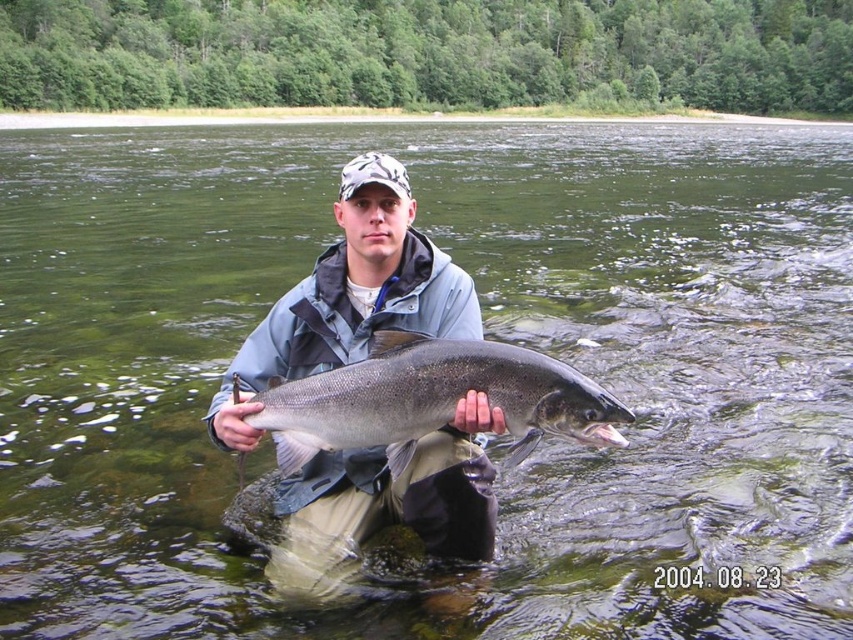
Question: From the image, what is the correct spatial relationship of gray matte fish at center in relation to shiny silver fish at center?

Choices:
 (A) left
 (B) right

Answer: (A)

Question: Is gray matte fish at center above shiny silver fish at center?

Choices:
 (A) yes
 (B) no

Answer: (A)

Question: Which object is closer to the camera taking this photo?

Choices:
 (A) shiny silver fish at center
 (B) gray matte fish at center

Answer: (A)

Question: Among these objects, which one is farthest from the camera?

Choices:
 (A) gray matte fish at center
 (B) shiny silver fish at center

Answer: (A)

Question: Is the position of gray matte fish at center less distant than that of shiny silver fish at center?

Choices:
 (A) yes
 (B) no

Answer: (B)